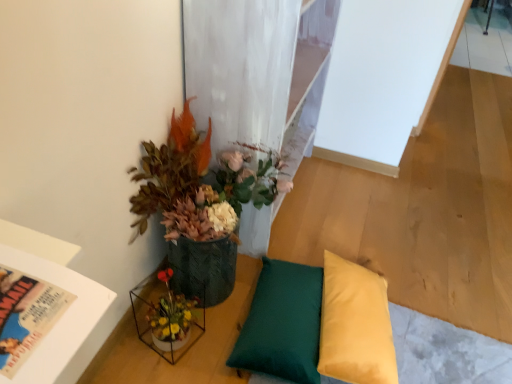
You are a GUI agent. You are given a task and a screenshot of the screen. Output one action in this format:
    pyautogui.click(x=<x>, y=<y>)
    Task: Click on the translucent glass vase at lower left
    
    Given the screenshot: What is the action you would take?
    pyautogui.click(x=166, y=318)

Locate an element on the screen. The height and width of the screenshot is (384, 512). yellow fabric pillow at lower right, which is the second pillow in left-to-right order is located at coordinates (355, 325).

How much space does yellow fabric pillow at lower right, which is the second pillow in left-to-right order, occupy vertically?

yellow fabric pillow at lower right, which is the second pillow in left-to-right order, is 5.83 inches tall.

This screenshot has height=384, width=512. In order to click on translucent glass vase at lower left in this screenshot , I will do `click(166, 318)`.

From a real-world perspective, who is located lower, green fabric pillow at lower center, the 1th pillow when ordered from left to right, or translucent glass vase at lower left?

From a 3D spatial view, green fabric pillow at lower center, the 1th pillow when ordered from left to right, is below.

Does green fabric pillow at lower center, the 1th pillow when ordered from left to right, have a greater width compared to translucent glass vase at lower left?

Result: Yes, green fabric pillow at lower center, the 1th pillow when ordered from left to right, is wider than translucent glass vase at lower left.

Which is in front, point (288, 377) or point (175, 353)?

The point (288, 377) is in front.

How many degrees apart are the facing directions of textured green pot at upper left and yellow fabric pillow at lower right, acting as the 1th pillow starting from the right?

The angular difference between textured green pot at upper left and yellow fabric pillow at lower right, acting as the 1th pillow starting from the right, is 7.37 degrees.

Where is `pillow that is the 1st one when counting backward from the textured green pot at upper left`? pillow that is the 1st one when counting backward from the textured green pot at upper left is located at coordinates (355, 325).

Is textured green pot at upper left next to yellow fabric pillow at lower right, acting as the 1th pillow starting from the right?

They are not placed beside each other.

Could you tell me if textured green pot at upper left is facing green fabric pillow at lower center, the 1th pillow when ordered from left to right?

Yes, textured green pot at upper left is facing green fabric pillow at lower center, the 1th pillow when ordered from left to right.

Considering the relative sizes of textured green pot at upper left and green fabric pillow at lower center, the 1th pillow when ordered from left to right, in the image provided, is textured green pot at upper left taller than green fabric pillow at lower center, the 1th pillow when ordered from left to right,?

Yes.

Can you confirm if textured green pot at upper left is wider than green fabric pillow at lower center, the 1th pillow when ordered from left to right?

Yes, textured green pot at upper left is wider than green fabric pillow at lower center, the 1th pillow when ordered from left to right.

Is textured green pot at upper left far away from green fabric pillow at lower center, the 1th pillow when ordered from left to right?

textured green pot at upper left is near green fabric pillow at lower center, the 1th pillow when ordered from left to right, not far away.

What's the angular difference between translucent glass vase at lower left and textured green pot at upper left's facing directions?

They differ by 1.58 degrees in their facing directions.

Looking at the image, does translucent glass vase at lower left seem bigger or smaller compared to textured green pot at upper left?

translucent glass vase at lower left is smaller than textured green pot at upper left.

From their relative heights in the image, would you say translucent glass vase at lower left is taller or shorter than textured green pot at upper left?

Clearly, translucent glass vase at lower left is shorter compared to textured green pot at upper left.

From the image's perspective, is translucent glass vase at lower left beneath textured green pot at upper left?

Yes.

How different are the orientations of textured green pot at upper left and translucent glass vase at lower left in degrees?

The angle between the facing direction of textured green pot at upper left and the facing direction of translucent glass vase at lower left is 1.58 degrees.

Is point (202, 278) farther from camera compared to point (156, 337)?

Yes, point (202, 278) is behind point (156, 337).

The image size is (512, 384). Identify the location of vase behind the textured green pot at upper left. (166, 318).

Based on the photo, which of these two, textured green pot at upper left or translucent glass vase at lower left, is smaller?

With smaller size is translucent glass vase at lower left.

In the scene shown: Considering the relative sizes of green fabric pillow at lower center, marked as the second pillow in a right-to-left arrangement, and textured green pot at upper left in the image provided, is green fabric pillow at lower center, marked as the second pillow in a right-to-left arrangement, thinner than textured green pot at upper left?

Indeed, green fabric pillow at lower center, marked as the second pillow in a right-to-left arrangement, has a lesser width compared to textured green pot at upper left.

Is green fabric pillow at lower center, marked as the second pillow in a right-to-left arrangement, facing towards textured green pot at upper left?

No, green fabric pillow at lower center, marked as the second pillow in a right-to-left arrangement, is not facing towards textured green pot at upper left.

Is green fabric pillow at lower center, marked as the second pillow in a right-to-left arrangement, outside of textured green pot at upper left?

Yes.

Is point (248, 318) closer or farther from the camera than point (272, 160)?

Point (248, 318) is positioned farther from the camera compared to point (272, 160).

Is green fabric pillow at lower center, marked as the second pillow in a right-to-left arrangement, at the left side of yellow fabric pillow at lower right, acting as the 1th pillow starting from the right?

Correct, you'll find green fabric pillow at lower center, marked as the second pillow in a right-to-left arrangement, to the left of yellow fabric pillow at lower right, acting as the 1th pillow starting from the right.

In the scene shown: Between green fabric pillow at lower center, marked as the second pillow in a right-to-left arrangement, and yellow fabric pillow at lower right, which is the second pillow in left-to-right order, which one is positioned behind?

green fabric pillow at lower center, marked as the second pillow in a right-to-left arrangement, is further from the camera.

What are the coordinates of `pillow above the yellow fabric pillow at lower right, which is the second pillow in left-to-right order (from the image's perspective)` in the screenshot? It's located at (282, 323).

Find the location of a particular element. The image size is (512, 384). the 2nd pillow located beneath the translucent glass vase at lower left (from a real-world perspective) is located at coordinates (282, 323).

Locate an element on the screen. The height and width of the screenshot is (384, 512). houseplant that is in front of the yellow fabric pillow at lower right, acting as the 1th pillow starting from the right is located at coordinates (200, 205).

Estimate the real-world distances between objects in this image. Which object is closer to green fabric pillow at lower center, marked as the second pillow in a right-to-left arrangement, translucent glass vase at lower left or textured green pot at upper left?

translucent glass vase at lower left is closer to green fabric pillow at lower center, marked as the second pillow in a right-to-left arrangement.

In the scene shown: Considering their positions, is green fabric pillow at lower center, the 1th pillow when ordered from left to right, positioned closer to translucent glass vase at lower left than textured green pot at upper left?

Among the two, textured green pot at upper left is located nearer to translucent glass vase at lower left.

From the image, which object appears to be nearer to yellow fabric pillow at lower right, acting as the 1th pillow starting from the right, translucent glass vase at lower left or green fabric pillow at lower center, the 1th pillow when ordered from left to right?

green fabric pillow at lower center, the 1th pillow when ordered from left to right, is closer to yellow fabric pillow at lower right, acting as the 1th pillow starting from the right.

Considering their positions, is yellow fabric pillow at lower right, which is the second pillow in left-to-right order, positioned closer to green fabric pillow at lower center, marked as the second pillow in a right-to-left arrangement, than textured green pot at upper left?

yellow fabric pillow at lower right, which is the second pillow in left-to-right order, is positioned closer to the anchor green fabric pillow at lower center, marked as the second pillow in a right-to-left arrangement.

From the image, which object appears to be farther from yellow fabric pillow at lower right, which is the second pillow in left-to-right order, green fabric pillow at lower center, the 1th pillow when ordered from left to right, or textured green pot at upper left?

textured green pot at upper left lies further to yellow fabric pillow at lower right, which is the second pillow in left-to-right order, than the other object.

From the image, which object appears to be nearer to translucent glass vase at lower left, textured green pot at upper left or yellow fabric pillow at lower right, acting as the 1th pillow starting from the right?

Based on the image, textured green pot at upper left appears to be nearer to translucent glass vase at lower left.

Estimate the real-world distances between objects in this image. Which object is further from green fabric pillow at lower center, the 1th pillow when ordered from left to right, textured green pot at upper left or yellow fabric pillow at lower right, which is the second pillow in left-to-right order?

Based on the image, textured green pot at upper left appears to be further to green fabric pillow at lower center, the 1th pillow when ordered from left to right.

Consider the image. When comparing their distances from green fabric pillow at lower center, the 1th pillow when ordered from left to right, does textured green pot at upper left or translucent glass vase at lower left seem closer?

translucent glass vase at lower left.

What are the coordinates of `vase between textured green pot at upper left and green fabric pillow at lower center, marked as the second pillow in a right-to-left arrangement, in the vertical direction` in the screenshot? It's located at (166, 318).

Locate an element on the screen. houseplant situated between translucent glass vase at lower left and yellow fabric pillow at lower right, which is the second pillow in left-to-right order, from left to right is located at coordinates (200, 205).

In order to click on pillow located between textured green pot at upper left and yellow fabric pillow at lower right, which is the second pillow in left-to-right order, in the left-right direction in this screenshot , I will do `click(282, 323)`.

The width and height of the screenshot is (512, 384). In order to click on pillow between translucent glass vase at lower left and yellow fabric pillow at lower right, acting as the 1th pillow starting from the right, from left to right in this screenshot , I will do `click(282, 323)`.